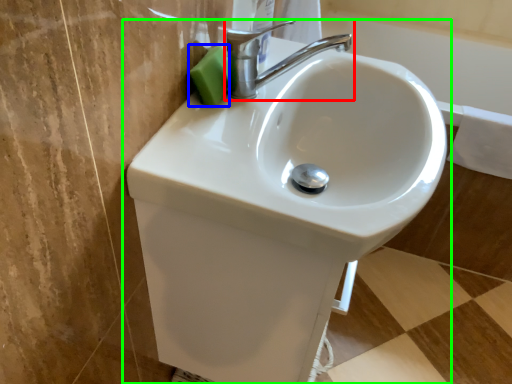
Question: Which is nearer to the tap (highlighted by a red box)? soap (highlighted by a blue box) or sink (highlighted by a green box).

Choices:
 (A) soap
 (B) sink

Answer: (A)